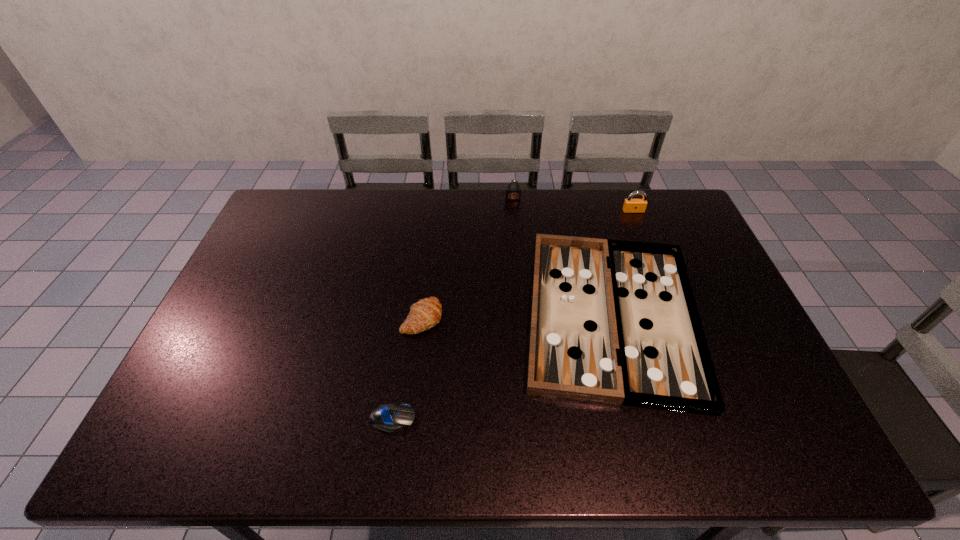
You are a GUI agent. You are given a task and a screenshot of the screen. Output one action in this format:
    pyautogui.click(x=<x>, y=<y>)
    Task: Click on the nearer padlock
    
    Given the screenshot: What is the action you would take?
    pyautogui.click(x=630, y=205)

The height and width of the screenshot is (540, 960). What are the coordinates of `the right padlock` in the screenshot? It's located at pos(630,205).

Identify the location of the left padlock. This screenshot has width=960, height=540. (512, 192).

The image size is (960, 540). I want to click on the farthest object, so click(x=512, y=192).

This screenshot has height=540, width=960. In order to click on crescent roll in this screenshot , I will do `click(426, 313)`.

Identify the location of gameboard. The image size is (960, 540). (616, 322).

Find the location of `the shortest object`. the shortest object is located at coordinates (388, 418).

Find the location of `free region located 0.340m to unlock the nearer padlock from the front`. free region located 0.340m to unlock the nearer padlock from the front is located at coordinates (660, 281).

Where is `free region located 0.200m on the front of the farther padlock near the keyhole`? The image size is (960, 540). free region located 0.200m on the front of the farther padlock near the keyhole is located at coordinates (516, 235).

The width and height of the screenshot is (960, 540). What are the coordinates of `vacant space located 0.060m on the right of the crescent roll` in the screenshot? It's located at (463, 318).